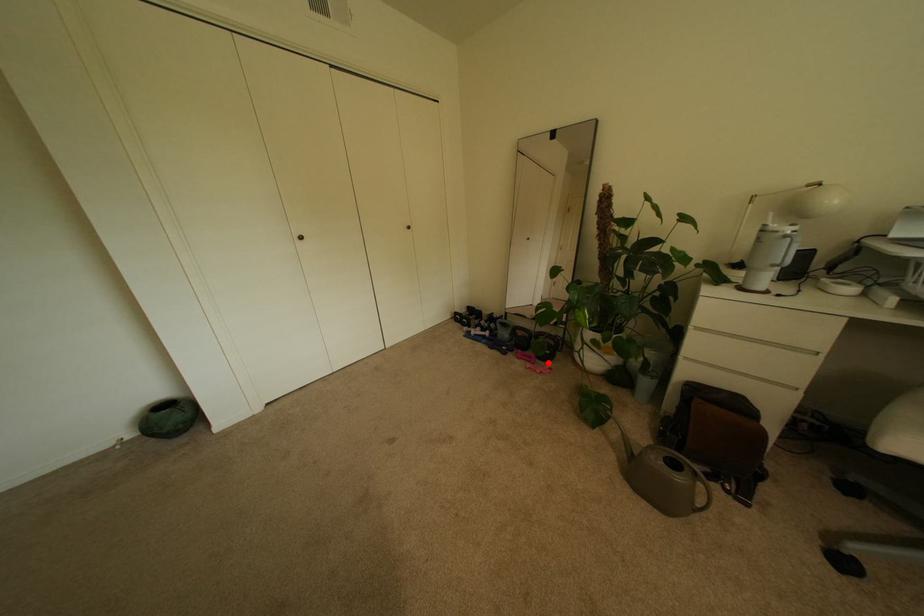
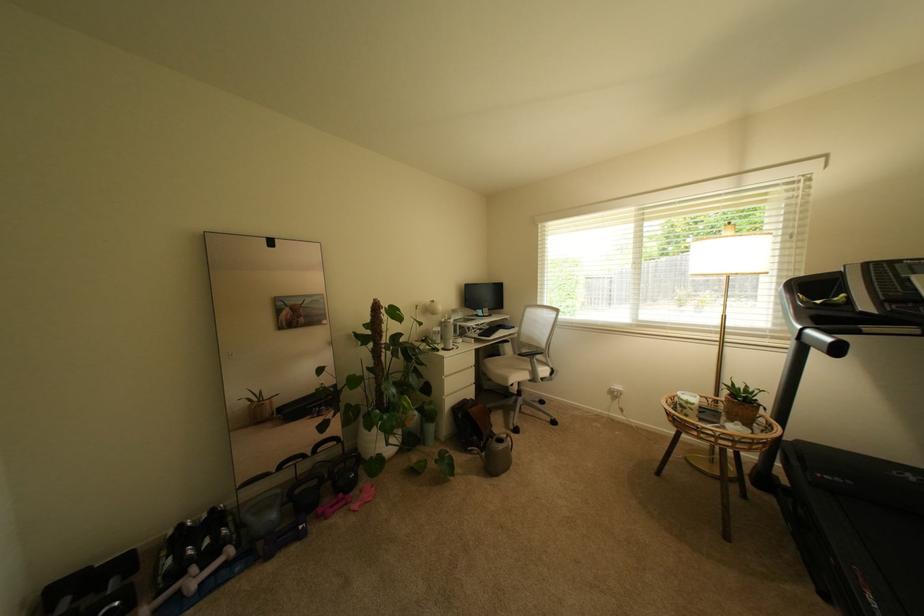
The point at the highlighted location is marked in the first image. Where is the corresponding point in the second image?

(359, 495)